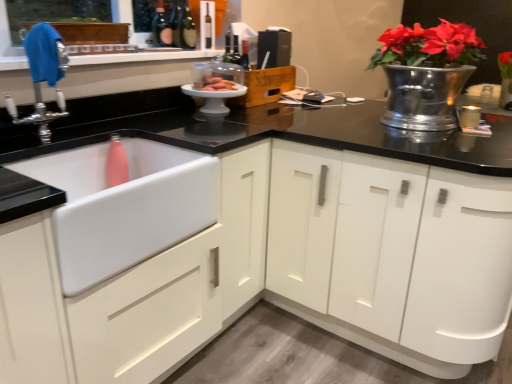
Question: Is white matte sink at lower left situated inside chrome metallic faucet at upper left or outside?

Choices:
 (A) inside
 (B) outside

Answer: (B)

Question: From their relative heights in the image, would you say white matte sink at lower left is taller or shorter than chrome metallic faucet at upper left?

Choices:
 (A) tall
 (B) short

Answer: (B)

Question: Which is farther from the dark brown glass wine bottle at upper center?

Choices:
 (A) black matte speaker at upper center, which appears as the first appliance when viewed from the back
 (B) white ceramic cake stand at center, the 2th appliance in the top-to-bottom sequence
 (C) pink matte water bottle at center
 (D) chrome metallic faucet at upper left
 (E) shiny silver vase at upper right

Answer: (E)

Question: Estimate the real-world distances between objects in this image. Which object is farther from the shiny silver vase at upper right?

Choices:
 (A) black matte speaker at upper center, placed as the 1th appliance when sorted from top to bottom
 (B) dark brown glass wine bottle at upper center
 (C) white glossy cabinet at center
 (D) white matte sink at lower left
 (E) chrome metallic faucet at upper left

Answer: (E)